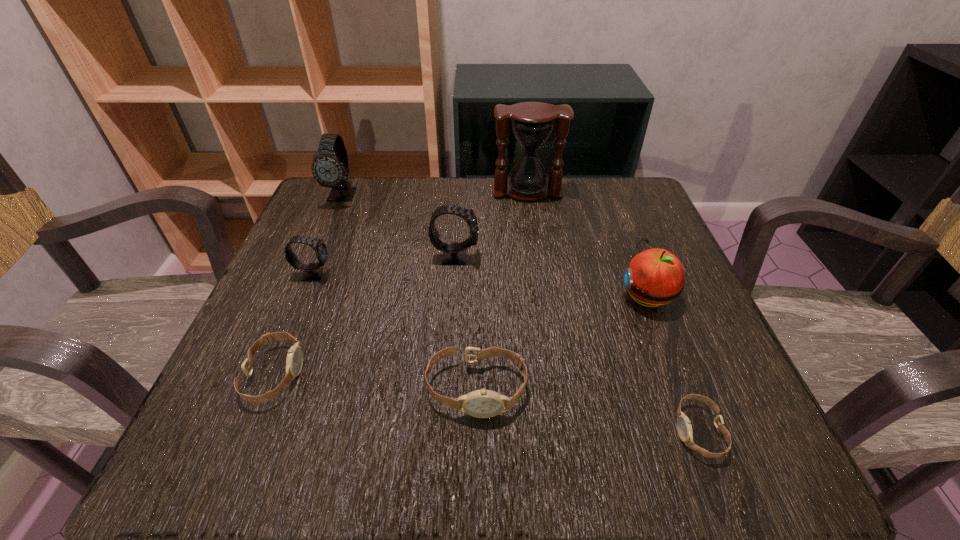
I want to click on the second closest gray watch to the fifth tallest watch, so click(455, 253).

Choose which beige watch is the nearest neighbor to the third tallest watch. Please provide its 2D coordinates. Your answer should be formatted as a tuple, i.e. [(x, y)], where the tuple contains the x and y coordinates of a point satisfying the conditions above.

[(294, 361)]

Locate an element on the screen. beige watch that is the closest to the rightmost watch is located at coordinates (483, 403).

Where is `free location that satisfies the following two spatial constraints: 1. on the face of the fifth nearest watch; 2. on the right side of the apple`? This screenshot has width=960, height=540. free location that satisfies the following two spatial constraints: 1. on the face of the fifth nearest watch; 2. on the right side of the apple is located at coordinates (452, 295).